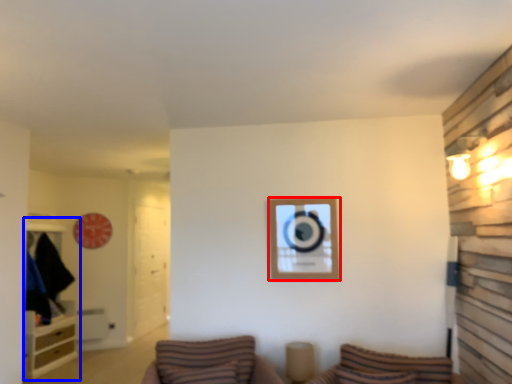
Question: Which point is closer to the camera, picture frame (highlighted by a red box) or entertainment center (highlighted by a blue box)?

Choices:
 (A) picture frame
 (B) entertainment center

Answer: (A)